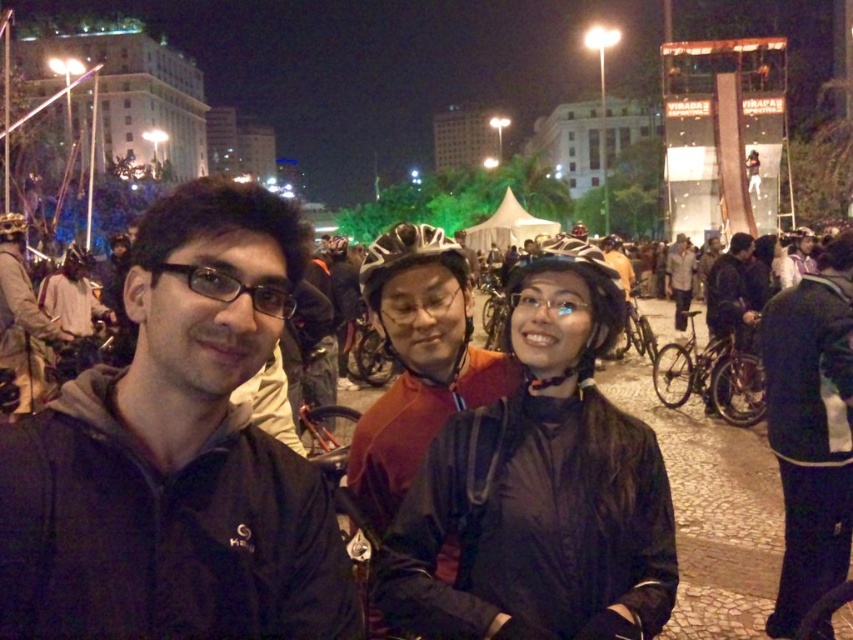
Question: Does matte red jacket at center appear on the right side of black matte glasses at center?

Choices:
 (A) no
 (B) yes

Answer: (B)

Question: Does matte red jacket at center have a greater width compared to dark blue jacket at center?

Choices:
 (A) no
 (B) yes

Answer: (A)

Question: Is black matte helmet at center wider than dark brown leather jacket at left?

Choices:
 (A) no
 (B) yes

Answer: (B)

Question: Which is nearer to the dark brown leather jacket at left?

Choices:
 (A) dark blue jacket at center
 (B) dark blue jacket at lower right

Answer: (B)

Question: Among these objects, which one is nearest to the camera?

Choices:
 (A) black matte glasses at center
 (B) matte red jacket at center
 (C) black matte helmet at center
 (D) dark blue jacket at center

Answer: (C)

Question: Estimate the real-world distances between objects in this image. Which object is farther from the dark blue jacket at center?

Choices:
 (A) black matte jacket at center
 (B) dark brown leather jacket at left
 (C) black matte glasses at center

Answer: (B)